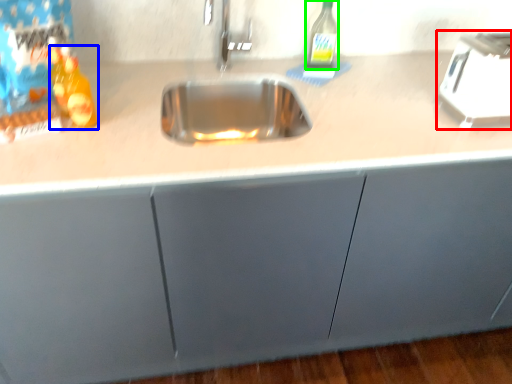
Question: Which is farther away from appliance (highlighted by a red box)? bottle (highlighted by a blue box) or bottle (highlighted by a green box)?

Choices:
 (A) bottle
 (B) bottle

Answer: (A)